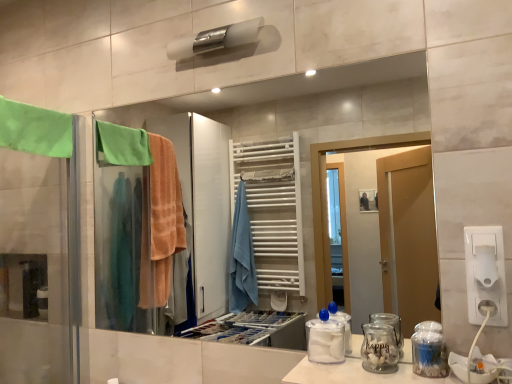
Question: In terms of height, does white plastic toilet paper at right look taller or shorter compared to clear plastic jar at lower right, positioned as the first glass jar in right-to-left order?

Choices:
 (A) short
 (B) tall

Answer: (A)

Question: From a real-world perspective, is white plastic toilet paper at right above or below clear plastic jar at lower right, positioned as the first glass jar in right-to-left order?

Choices:
 (A) below
 (B) above

Answer: (B)

Question: Which object is positioned farthest from the white plastic toilet paper at right?

Choices:
 (A) transparent glass jar at lower right
 (B) green fabric towel at left
 (C) transparent plastic container at center
 (D) matte glass mirror at center
 (E) white plastic socket at lower right

Answer: (D)

Question: Which object is positioned farthest from the green fabric towel at left?

Choices:
 (A) white plastic socket at lower right
 (B) transparent plastic container at center
 (C) white glossy sink at lower right
 (D) clear glass jar at lower right, placed as the 1th glass jar when sorted from left to right
 (E) white matte towel bar at upper center

Answer: (C)